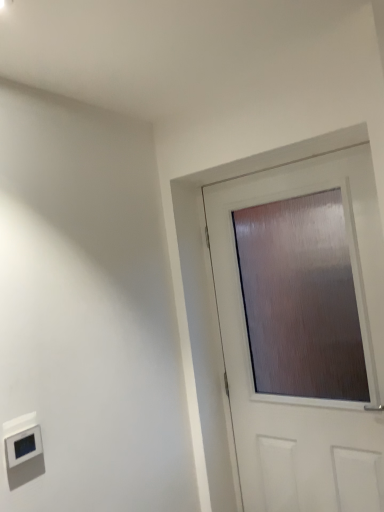
Question: Is matte brown door at center wider or thinner than matte white thermostat at lower left?

Choices:
 (A) wide
 (B) thin

Answer: (B)

Question: From a real-world perspective, relative to matte white thermostat at lower left, is matte brown door at center vertically above or below?

Choices:
 (A) below
 (B) above

Answer: (B)

Question: From the image's perspective, is matte brown door at center positioned above or below matte white thermostat at lower left?

Choices:
 (A) above
 (B) below

Answer: (A)

Question: In terms of width, does matte white thermostat at lower left look wider or thinner when compared to matte brown door at center?

Choices:
 (A) wide
 (B) thin

Answer: (A)

Question: In terms of height, does matte white thermostat at lower left look taller or shorter compared to matte brown door at center?

Choices:
 (A) short
 (B) tall

Answer: (A)

Question: From a real-world perspective, is matte white thermostat at lower left positioned above or below matte brown door at center?

Choices:
 (A) above
 (B) below

Answer: (B)

Question: Based on their sizes in the image, would you say matte white thermostat at lower left is bigger or smaller than matte brown door at center?

Choices:
 (A) big
 (B) small

Answer: (B)